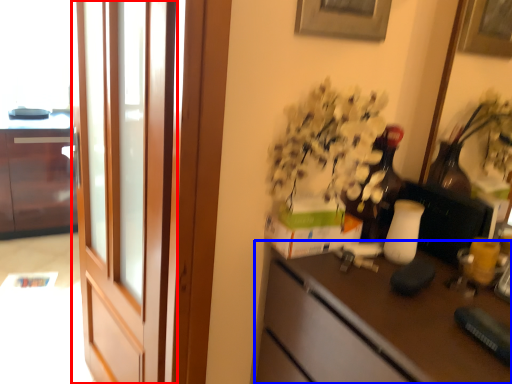
Question: Among these objects, which one is nearest to the camera, screen door (highlighted by a red box) or desk (highlighted by a blue box)?

Choices:
 (A) screen door
 (B) desk

Answer: (B)